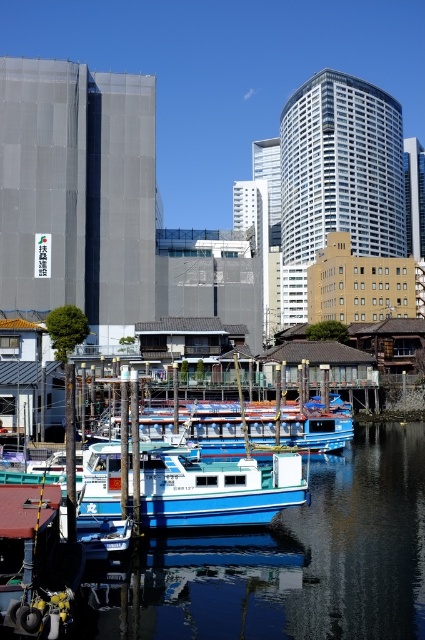
Question: Is blue matte boat at center above blue wooden boat at center?

Choices:
 (A) yes
 (B) no

Answer: (B)

Question: Does blue glossy boat at center have a larger size compared to blue matte boat at center?

Choices:
 (A) yes
 (B) no

Answer: (A)

Question: Which object is the closest to the blue wooden boat at center?

Choices:
 (A) blue glossy boat at center
 (B) blue matte boat at center

Answer: (A)

Question: Is blue glossy boat at center positioned at the back of blue matte boat at center?

Choices:
 (A) no
 (B) yes

Answer: (A)

Question: Which object is positioned farthest from the blue wooden boat at center?

Choices:
 (A) blue matte boat at center
 (B) blue glossy boat at center

Answer: (A)

Question: Which point appears closest to the camera in this image?

Choices:
 (A) (147, 516)
 (B) (303, 412)
 (C) (243, 602)

Answer: (C)